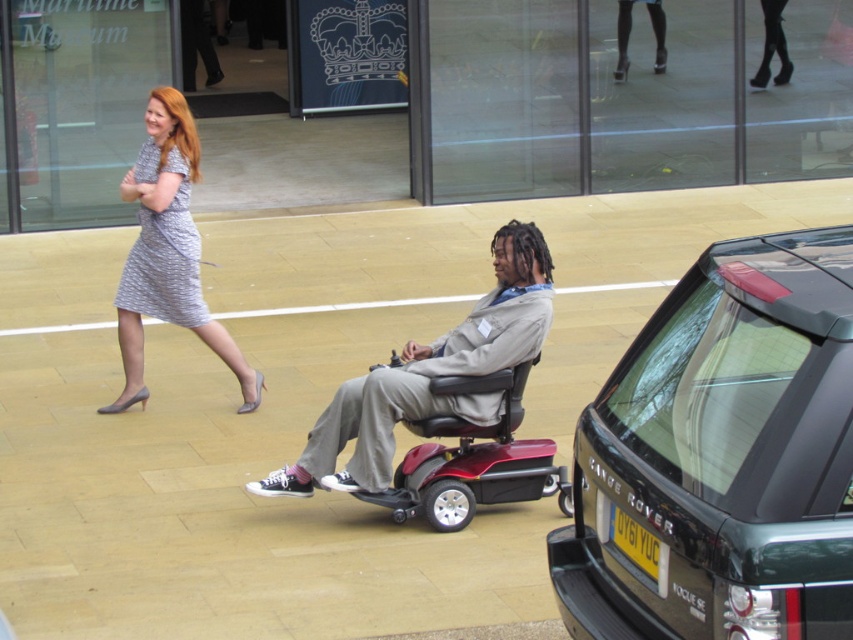
You are a person who is 1.7 meters tall and wants to walk through the space between the gray fabric wheelchair at center and the metallic red mobility scooter at center. The space between them is 1 meter. Can you pass through without bending down?

The gray fabric wheelchair at center is much taller than the metallic red mobility scooter at center. Since the height of the wheelchair is higher, the space between them might be limited vertically. However, the question mentions the space between them is 1 meter, which refers to horizontal distance. Since your height is 1.7 meters, and the vertical clearance isn not specified, it is possible you can pass through the 1 meter gap horizontally without needing to bend down. But if the wheelchair is blocking a

You are standing at the entrance of the Maritime Museum and see the dark gray metallic range rover at center right and the gray printed dress at left. Which object is positioned to the right side of the other?

The dark gray metallic range rover at center right is positioned to the right of the gray printed dress at left.

You are a visitor at the Maritime Museum and want to park your gray fabric wheelchair at center near the entrance. However, there is a metallic red mobility scooter at center already occupying the spot. Based on their sizes, can your wheelchair fit in the same space if the scooter moves?

The gray fabric wheelchair at center is larger in size compared to the metallic red mobility scooter at center. Therefore, if the metallic red mobility scooter at center moves, the gray fabric wheelchair at center may not fit in the same space due to its larger size.